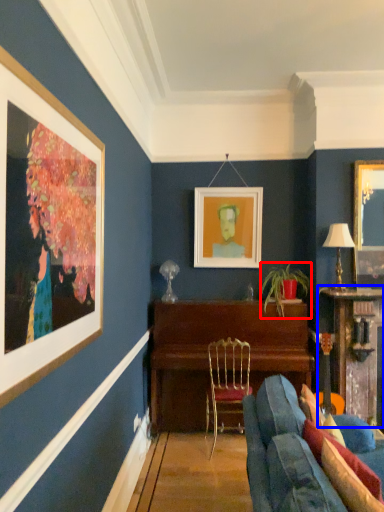
Question: Which of the following is the farthest to the observer, houseplant (highlighted by a red box) or table (highlighted by a blue box)?

Choices:
 (A) houseplant
 (B) table

Answer: (A)